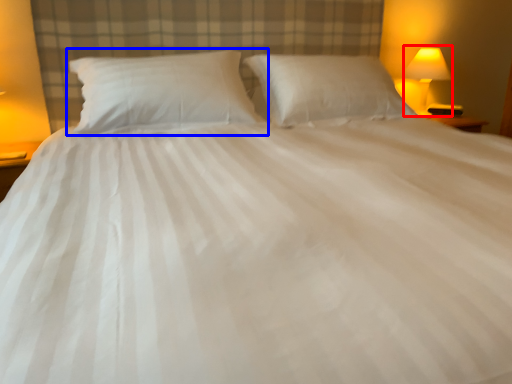
Question: Which object appears closest to the camera in this image, bedside lamp (highlighted by a red box) or pillow (highlighted by a blue box)?

Choices:
 (A) bedside lamp
 (B) pillow

Answer: (B)